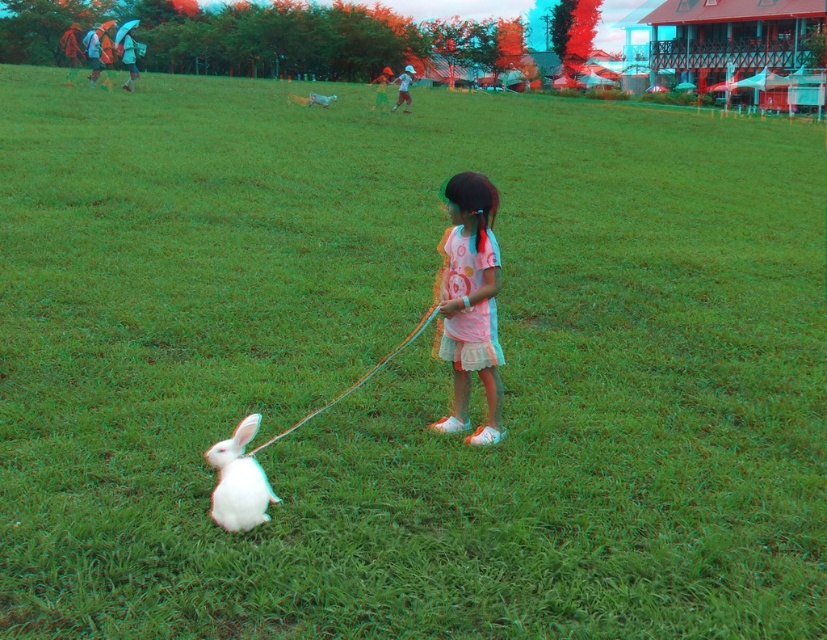
You are a photographer trying to capture the pink cotton dress at center and the white fluffy rabbit at lower left in a single shot. Based on their positions, will the rabbit be in the foreground or background of the photo?

The white fluffy rabbit at lower left will be in the background because the pink cotton dress at center is further to the viewer than the rabbit.